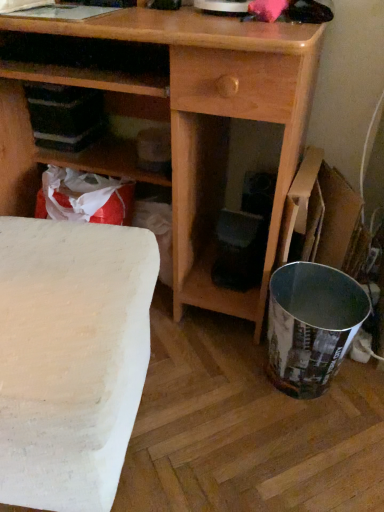
Find the location of a particular element. cardboard box at right is located at coordinates (321, 215).

You are a GUI agent. You are given a task and a screenshot of the screen. Output one action in this format:
    pyautogui.click(x=<x>, y=<y>)
    Task: Click on the desk lying on the left of cardboard box at right
    
    Given the screenshot: What is the action you would take?
    pyautogui.click(x=166, y=117)

Is point (220, 39) in front of point (292, 231)?

Yes, point (220, 39) is in front of point (292, 231).

Considering the relative sizes of wooden desk at center and cardboard box at right in the image provided, is wooden desk at center taller than cardboard box at right?

Yes, wooden desk at center is taller than cardboard box at right.

Considering the sizes of objects wooden desk at center and cardboard box at right in the image provided, who is bigger, wooden desk at center or cardboard box at right?

With larger size is wooden desk at center.

Consider the image. Considering the sizes of objects cardboard box at right and white matte table at lower left in the image provided, who is shorter, cardboard box at right or white matte table at lower left?

cardboard box at right.

How far apart are cardboard box at right and white matte table at lower left?

The distance of cardboard box at right from white matte table at lower left is 20.44 inches.

Considering the relative positions of cardboard box at right and white matte table at lower left in the image provided, is cardboard box at right to the left of white matte table at lower left from the viewer's perspective?

No.

Considering their positions, is cardboard box at right located in front of or behind wooden desk at center?

Clearly, cardboard box at right is behind wooden desk at center.

From the image's perspective, relative to wooden desk at center, is cardboard box at right above or below?

From the image's perspective, cardboard box at right appears below wooden desk at center.

Can you confirm if cardboard box at right is bigger than wooden desk at center?

Incorrect, cardboard box at right is not larger than wooden desk at center.

Is cardboard box at right surrounding wooden desk at center?

That's incorrect, wooden desk at center is not inside cardboard box at right.

Is white matte table at lower left positioned with its back to wooden desk at center?

Yes.

Which is closer, (62, 422) or (63, 57)?

The point (62, 422) is closer.

Who is shorter, white matte table at lower left or wooden desk at center?

With less height is white matte table at lower left.

Which is more to the left, white matte table at lower left or wooden desk at center?

white matte table at lower left is more to the left.

Is point (109, 332) closer to viewer compared to point (286, 262)?

Yes, it is.

Is white matte table at lower left taller or shorter than cardboard box at right?

Considering their sizes, white matte table at lower left has more height than cardboard box at right.

From the image's perspective, is white matte table at lower left below cardboard box at right?

Indeed, from the image's perspective, white matte table at lower left is shown beneath cardboard box at right.

From a real-world perspective, is white matte table at lower left located higher than cardboard box at right?

Yes, from a real-world perspective, white matte table at lower left is over cardboard box at right

From a real-world perspective, between wooden desk at center and white matte table at lower left, who is vertically lower?

In real-world perspective, white matte table at lower left is lower.

From the image's perspective, which one is positioned lower, wooden desk at center or white matte table at lower left?

white matte table at lower left is shown below in the image.

How many degrees apart are the facing directions of wooden desk at center and white matte table at lower left?

wooden desk at center and white matte table at lower left are facing 13.4 degrees away from each other.

Is wooden desk at center turned away from white matte table at lower left?

No.

In the image, there is a wooden desk at center. Where is `cardboard box below it (from the image's perspective)`? The height and width of the screenshot is (512, 384). cardboard box below it (from the image's perspective) is located at coordinates (321, 215).

Locate an element on the screen. This screenshot has height=512, width=384. cardboard box lying behind the white matte table at lower left is located at coordinates click(x=321, y=215).

Which object lies further to the anchor point white matte table at lower left, wooden desk at center or cardboard box at right?

Based on the image, cardboard box at right appears to be further to white matte table at lower left.

Which object lies nearer to the anchor point wooden desk at center, cardboard box at right or white matte table at lower left?

cardboard box at right is closer to wooden desk at center.

Which object lies further to the anchor point cardboard box at right, white matte table at lower left or wooden desk at center?

white matte table at lower left.

From the image, which object appears to be farther from white matte table at lower left, cardboard box at right or wooden desk at center?

cardboard box at right is positioned further to the anchor white matte table at lower left.

Based on their spatial positions, is wooden desk at center or white matte table at lower left further from cardboard box at right?

Among the two, white matte table at lower left is located further to cardboard box at right.

Considering their positions, is white matte table at lower left positioned closer to wooden desk at center than cardboard box at right?

cardboard box at right lies closer to wooden desk at center than the other object.

Where is `desk between white matte table at lower left and cardboard box at right`? desk between white matte table at lower left and cardboard box at right is located at coordinates (166, 117).